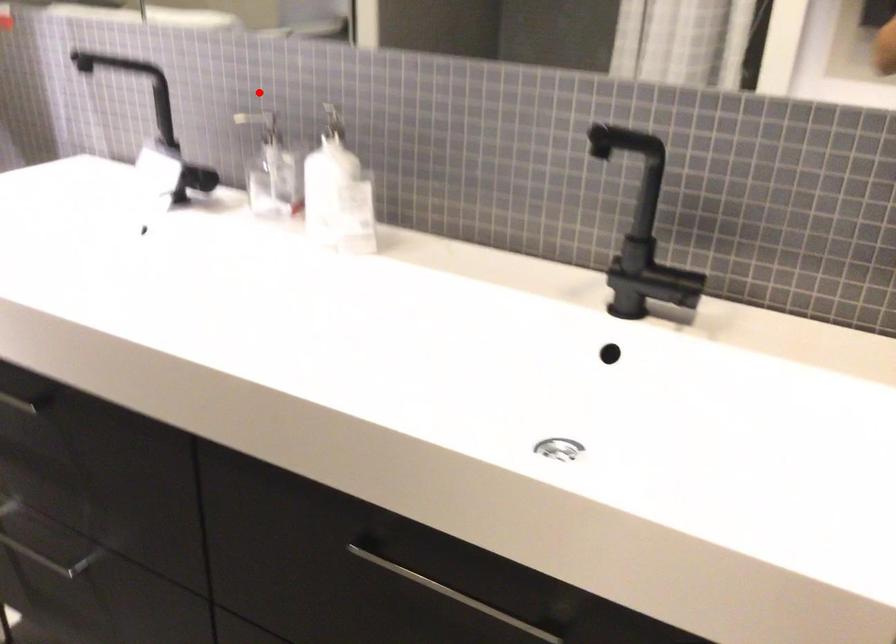
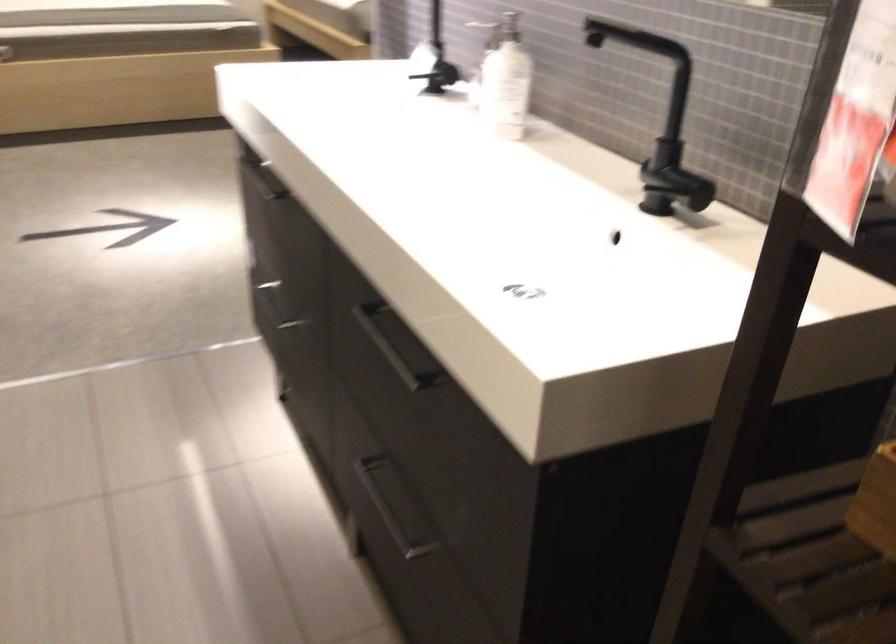
In the second image, find the point that corresponds to the highlighted location in the first image.

(503, 8)